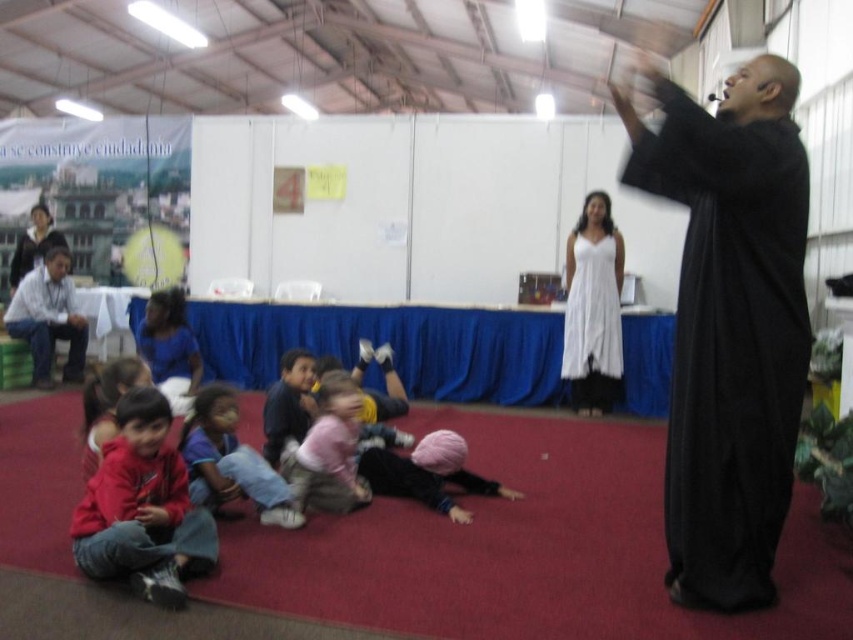
Question: Observing the image, what is the correct spatial positioning of black matte robe at right in reference to matte gray shirt at left?

Choices:
 (A) left
 (B) right

Answer: (B)

Question: Which is farther from the dark blue shirt at center?

Choices:
 (A) white lace dress at center
 (B) pink fabric at center
 (C) matte red hoodie at lower left

Answer: (A)

Question: Considering the real-world distances, which object is closest to the white shirt at left?

Choices:
 (A) matte red hoodie at lower left
 (B) blue fabric shirt at lower left
 (C) pink fabric at center

Answer: (B)

Question: Among these points, which one is nearest to the camera?

Choices:
 (A) (610, 330)
 (B) (271, 451)

Answer: (B)

Question: Is white shirt at left further to camera compared to matte red hoodie at lower left?

Choices:
 (A) yes
 (B) no

Answer: (A)

Question: Can you confirm if white lace dress at center is bigger than pink fabric at center?

Choices:
 (A) no
 (B) yes

Answer: (B)